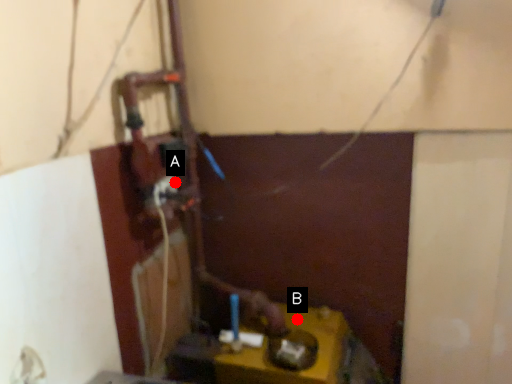
Question: Two points are circled on the image, labeled by A and B beside each circle. Which point is further to the camera?

Choices:
 (A) A is further
 (B) B is further

Answer: (B)